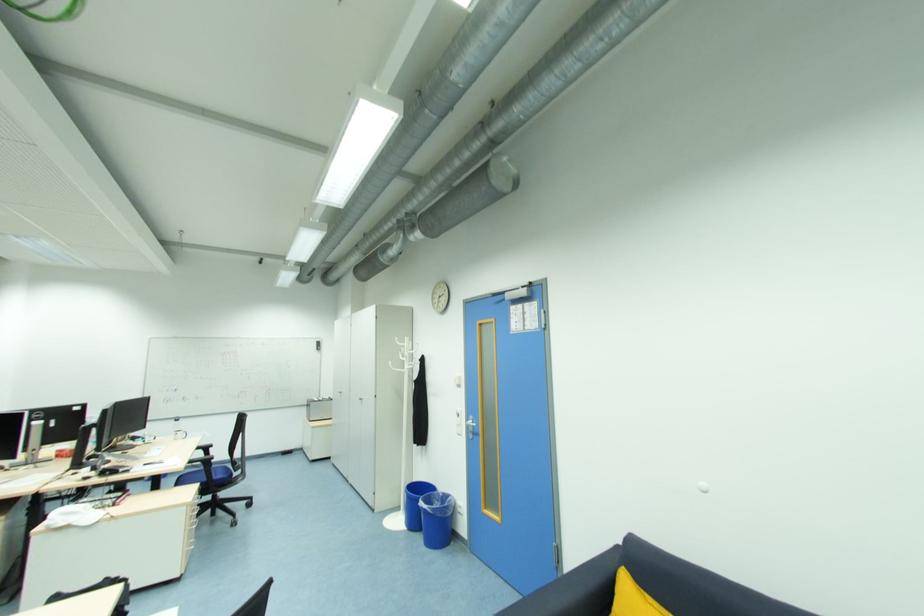
What do you see at coordinates (248, 421) in the screenshot? I see `the chair back top rail` at bounding box center [248, 421].